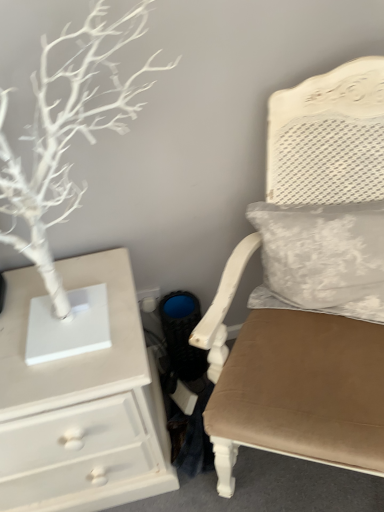
The height and width of the screenshot is (512, 384). What are the coordinates of `vacant space situated above white painted wood chest of drawers at left (from a real-world perspective)` in the screenshot? It's located at (45, 328).